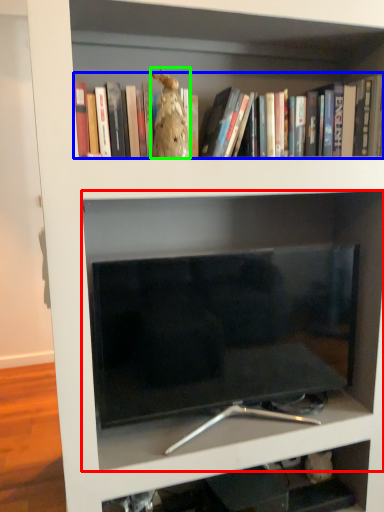
Question: Estimate the real-world distances between objects in this image. Which object is closer to shelf (highlighted by a red box), book (highlighted by a blue box) or animal (highlighted by a green box)?

Choices:
 (A) book
 (B) animal

Answer: (A)